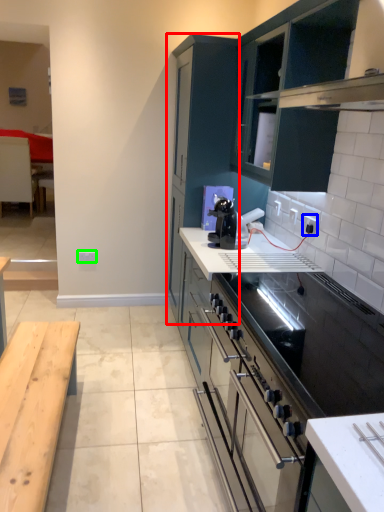
Question: Which object is the farthest from cabinetry (highlighted by a red box)? Choose among these: electric outlet (highlighted by a blue box) or electric outlet (highlighted by a green box).

Choices:
 (A) electric outlet
 (B) electric outlet

Answer: (B)